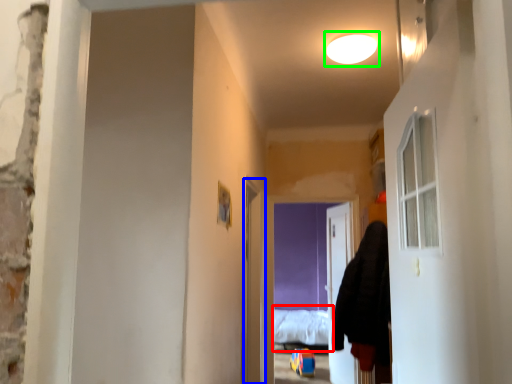
Question: Which object is positioned closest to bed (highlighted by a red box)? Select from screen door (highlighted by a blue box) and light (highlighted by a green box).

Choices:
 (A) screen door
 (B) light

Answer: (A)